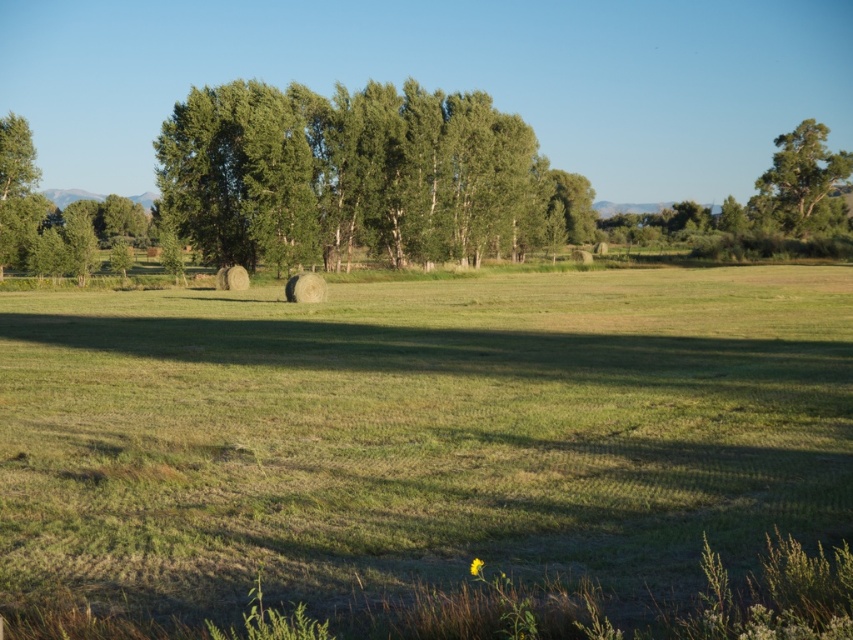
You are standing in the middle of the field in the image. You see two points marked on the ground. Which point is closer to you, point (167, 291) or point (194, 104)?

Point (167, 291) is closer to the viewer than point (194, 104).

You are standing in the middle of the green grassy field at center and want to walk towards the green leafy tree at upper right. Which direction should you face to move towards it?

You should face towards the upper right direction to walk towards the green leafy tree at upper right since the green grassy field at center is in front of it, meaning the tree is located behind the field from your current position.

Based on the photo, you are standing at the origin point in the middle of the field. You see two points marked in the image, point 1 at coordinates point (804,150) and point 2 at coordinates point (32,138). Which point is closer to you?

Point (32,138) is closer to you because it is in front of point (804,150).